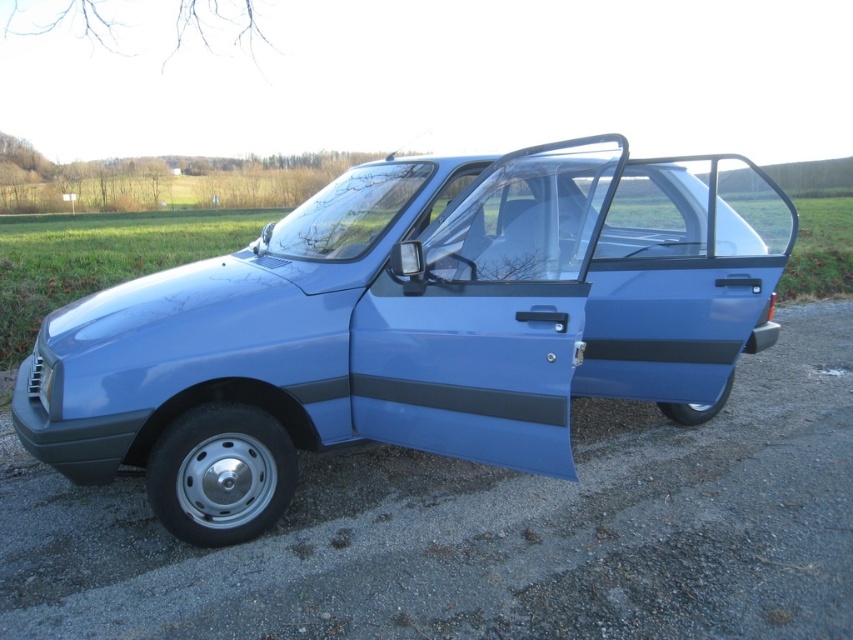
Is matte blue car at center positioned at the back of black matte stripe at door right?

No, it is not.

Does matte blue car at center appear under black matte stripe at door right?

No.

Which is behind, point (541, 305) or point (633, 352)?

Positioned behind is point (633, 352).

Where is `matte blue car at center`? This screenshot has height=640, width=853. matte blue car at center is located at coordinates (409, 324).